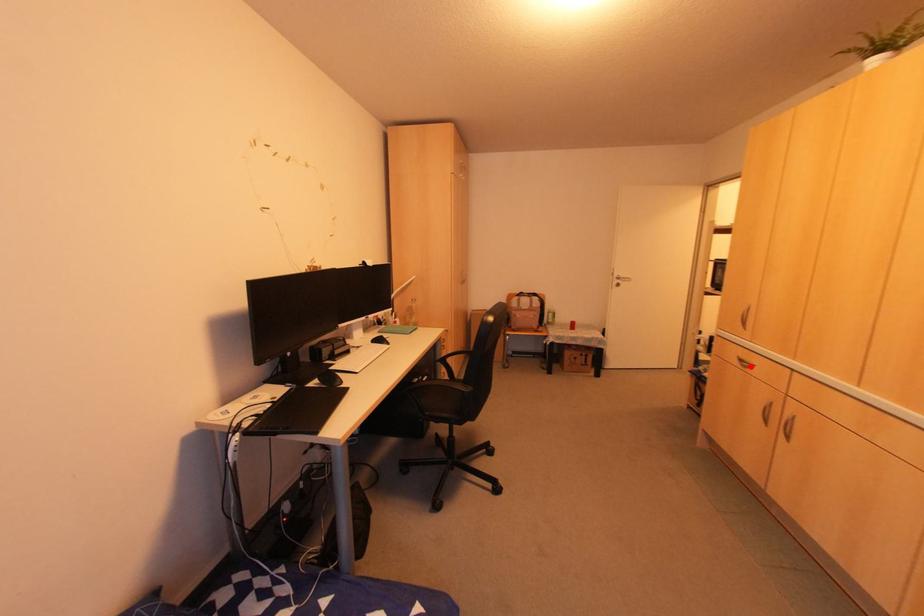
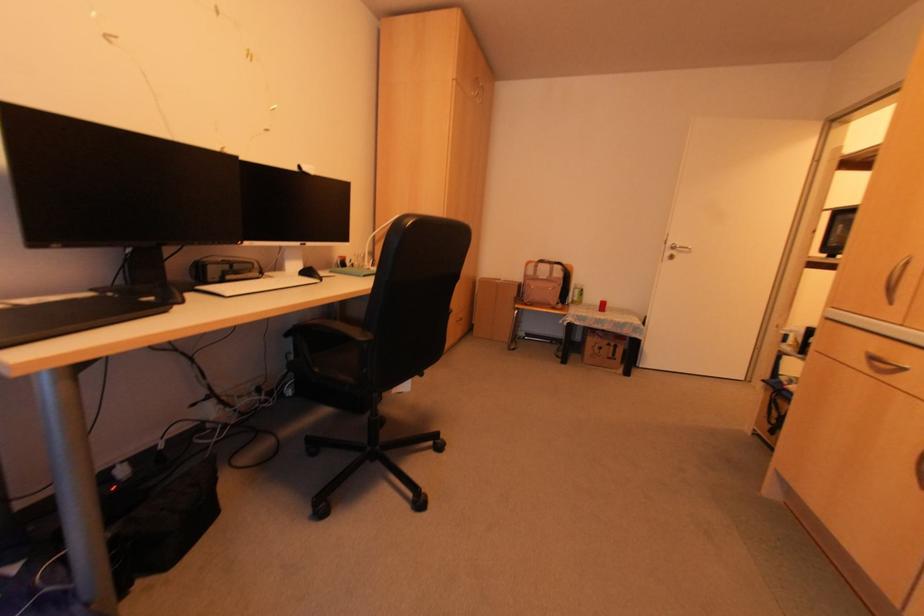
Question: I am providing you with two images of the same scene from different viewpoints. A red point is shown in image1. For the corresponding object point in image2, is it positioned nearer or farther from the camera?

Choices:
 (A) Nearer
 (B) Farther

Answer: (B)